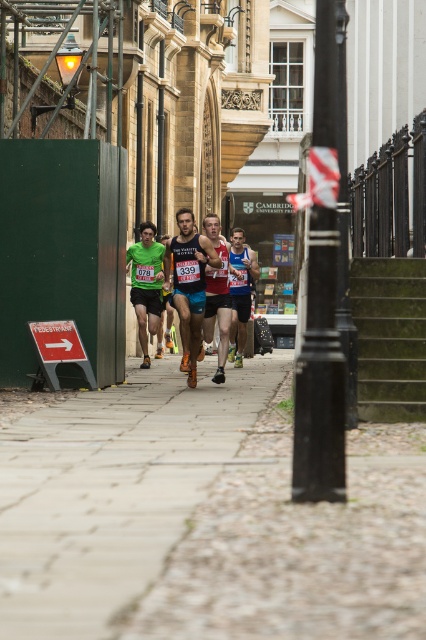
Is green fabric runner at center wider than reddish-brown fabric running at center?

Indeed, green fabric runner at center has a greater width compared to reddish-brown fabric running at center.

At what (x,y) coordinates should I click in order to perform the action: click on green fabric runner at center. Please return your answer as a coordinate pair (x, y). Image resolution: width=426 pixels, height=640 pixels. Looking at the image, I should click on [x=146, y=284].

Is point (198, 288) behind point (230, 307)?

No, it is in front of (230, 307).

Is point (175, 305) behind point (207, 276)?

No, (175, 305) is in front of (207, 276).

Where is `matte blue shorts at center`? This screenshot has width=426, height=640. matte blue shorts at center is located at coordinates (189, 285).

Can you confirm if concrete paving at center is positioned below blue fabric running suit at center?

Indeed, concrete paving at center is positioned under blue fabric running suit at center.

Can you confirm if concrete paving at center is positioned above blue fabric running suit at center?

No.

Between point (48, 513) and point (232, 285), which one is positioned in front?

Positioned in front is point (48, 513).

Where is `concrete paving at center`? This screenshot has width=426, height=640. concrete paving at center is located at coordinates (114, 488).